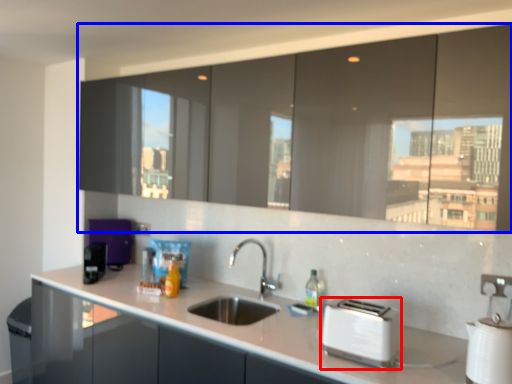
Question: Which object appears closest to the camera in this image, toaster (highlighted by a red box) or cabinetry (highlighted by a blue box)?

Choices:
 (A) toaster
 (B) cabinetry

Answer: (B)